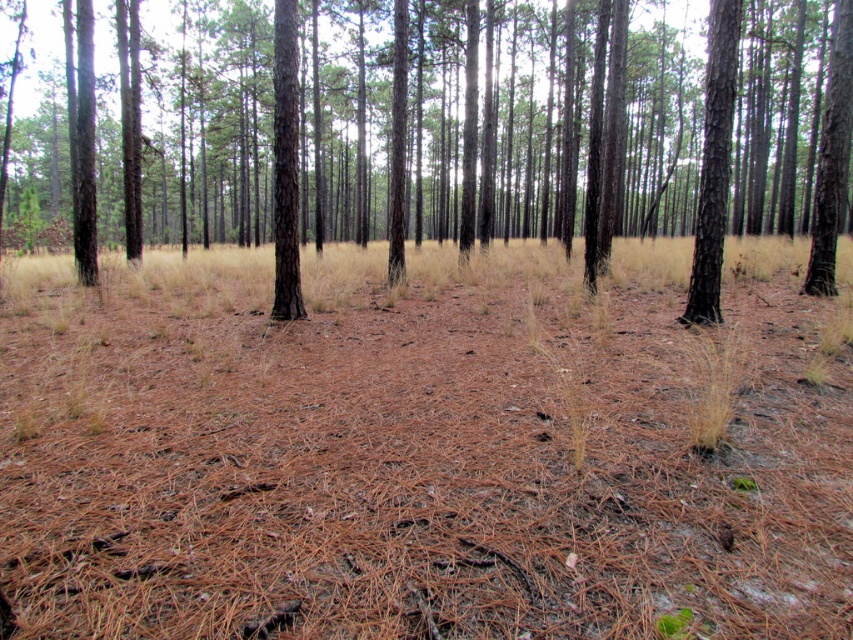
Does point (149, 564) come farther from viewer compared to point (486, 212)?

No, (149, 564) is closer to viewer.

Is brown dry grass at center smaller than brown smooth tree at center?

Yes, brown dry grass at center is smaller than brown smooth tree at center.

Which is behind, point (282, 525) or point (577, 36)?

The point (577, 36) is more distant.

Locate an element on the screen. This screenshot has height=640, width=853. brown dry grass at center is located at coordinates (426, 445).

Between brown dry grass at center and smooth brown tree trunk at right, which one has less height?

Standing shorter between the two is smooth brown tree trunk at right.

Which is below, brown dry grass at center or smooth brown tree trunk at right?

Positioned lower is smooth brown tree trunk at right.

Where is `brown dry grass at center`? The width and height of the screenshot is (853, 640). brown dry grass at center is located at coordinates (426, 445).

Which is behind, point (73, 528) or point (279, 316)?

The point (279, 316) is more distant.

Can you confirm if brown dry grass at center is positioned to the right of smooth brown tree at center?

Indeed, brown dry grass at center is positioned on the right side of smooth brown tree at center.

Between point (688, 566) and point (293, 61), which one is positioned behind?

The point (293, 61) is behind.

Identify the location of brown dry grass at center. (426, 445).